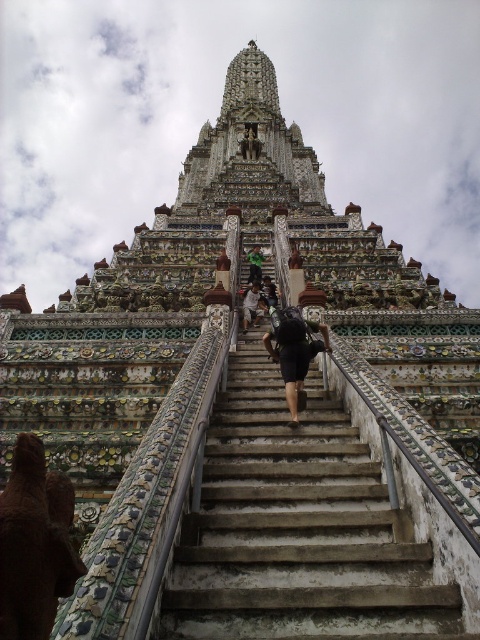
Can you confirm if dark gray backpack at center is thinner than dark blue fabric backpack at center?

In fact, dark gray backpack at center might be wider than dark blue fabric backpack at center.

Can you confirm if dark gray backpack at center is bigger than dark blue fabric backpack at center?

Correct, dark gray backpack at center is larger in size than dark blue fabric backpack at center.

Identify the location of dark gray backpack at center. This screenshot has height=640, width=480. (252, 305).

Is black matte backpack at center shorter than dark gray backpack at center?

Incorrect, black matte backpack at center's height does not fall short of dark gray backpack at center's.

Does point (324, 323) lie behind point (259, 289)?

No.

Locate an element on the screen. black matte backpack at center is located at coordinates (294, 353).

Who is shorter, concrete stairs at center or green fabric at center?

Standing shorter between the two is green fabric at center.

Can you confirm if concrete stairs at center is shorter than green fabric at center?

No, concrete stairs at center is not shorter than green fabric at center.

Who is more forward, (397, 560) or (257, 244)?

Positioned in front is point (397, 560).

I want to click on concrete stairs at center, so click(x=295, y=529).